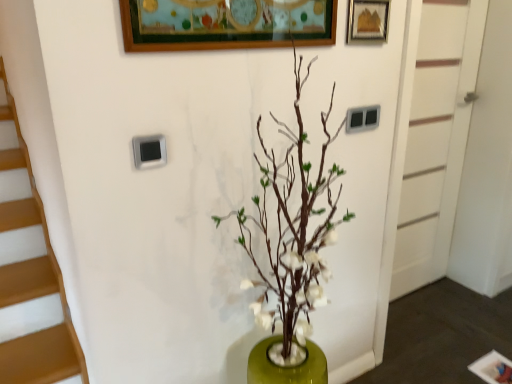
Image resolution: width=512 pixels, height=384 pixels. Describe the element at coordinates (436, 139) in the screenshot. I see `white painted wood door at right` at that location.

Identify the location of green matte vase at center. (291, 252).

Which is more to the right, white painted wood door at right or wooden picture frame at upper right?

white painted wood door at right is more to the right.

Is white painted wood door at right positioned far away from wooden picture frame at upper right?

Yes, white painted wood door at right is far from wooden picture frame at upper right.

From a real-world perspective, is white painted wood door at right above or below wooden picture frame at upper right?

Clearly, from a real-world perspective, white painted wood door at right is below wooden picture frame at upper right.

Is wooden picture frame at upper right a part of white painted wood door at right?

Actually, wooden picture frame at upper right is outside white painted wood door at right.

Can you confirm if green matte vase at center is shorter than wooden picture frame at upper right?

No.

Based on the photo, is green matte vase at center next to wooden picture frame at upper right and touching it?

They are not placed beside each other.

Does green matte vase at center turn towards wooden picture frame at upper right?

No, green matte vase at center is not facing towards wooden picture frame at upper right.

Is wooden picture frame at upper right far away from green matte vase at center?

They are positioned close to each other.

Relative to green matte vase at center, is wooden picture frame at upper right in front or behind?

wooden picture frame at upper right is behind green matte vase at center.

Is point (359, 25) more distant than point (287, 176)?

Yes.

Is point (365, 11) farther from viewer compared to point (410, 136)?

No, (365, 11) is closer to viewer.

From a real-world perspective, is wooden picture frame at upper right positioned above or below white painted wood door at right?

Clearly, from a real-world perspective, wooden picture frame at upper right is above white painted wood door at right.

Which of these two, wooden picture frame at upper right or white painted wood door at right, stands taller?

white painted wood door at right.

From the picture: Is there a large distance between green matte vase at center and white painted wood door at right?

Yes.

Which is further, (312, 350) or (431, 194)?

The point (431, 194) is more distant.

From the image's perspective, is green matte vase at center above or below white painted wood door at right?

Based on their image positions, green matte vase at center is located beneath white painted wood door at right.

From the image's perspective, between white painted wood door at right and green matte vase at center, which one is located above?

From the image's view, white painted wood door at right is above.

Is white painted wood door at right touching green matte vase at center?

white painted wood door at right and green matte vase at center are clearly separated.

Is point (432, 111) closer or farther from the camera than point (314, 246)?

Point (432, 111) is farther from the camera than point (314, 246).

Looking at their sizes, would you say white painted wood door at right is wider or thinner than green matte vase at center?

Clearly, white painted wood door at right has less width compared to green matte vase at center.

Where is `door behind the wooden picture frame at upper right`? door behind the wooden picture frame at upper right is located at coordinates (436, 139).

The image size is (512, 384). What are the coordinates of `picture frame to the right of green matte vase at center` in the screenshot? It's located at (367, 20).

Consider the image. Looking at the image, which one is located closer to wooden picture frame at upper right, white painted wood door at right or green matte vase at center?

green matte vase at center is positioned closer to the anchor wooden picture frame at upper right.

Looking at the image, which one is located further to green matte vase at center, white painted wood door at right or wooden picture frame at upper right?

The object further to green matte vase at center is white painted wood door at right.

Which object lies nearer to the anchor point green matte vase at center, wooden picture frame at upper right or white painted wood door at right?

wooden picture frame at upper right lies closer to green matte vase at center than the other object.

Considering their positions, is green matte vase at center positioned closer to wooden picture frame at upper right than white painted wood door at right?

green matte vase at center is closer to wooden picture frame at upper right.

Considering their positions, is wooden picture frame at upper right positioned further to white painted wood door at right than green matte vase at center?

The object further to white painted wood door at right is green matte vase at center.

From the image, which object appears to be farther from white painted wood door at right, green matte vase at center or wooden picture frame at upper right?

green matte vase at center is positioned further to the anchor white painted wood door at right.

I want to click on picture frame positioned between green matte vase at center and white painted wood door at right from near to far, so click(367, 20).